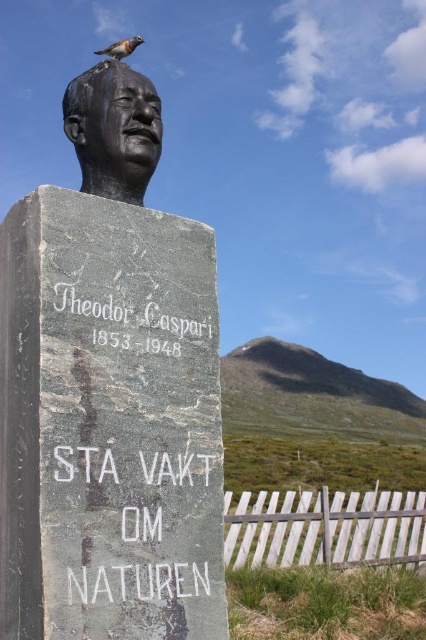
Question: Is bronze bust at upper center positioned behind brown speckled feather at upper center?

Choices:
 (A) yes
 (B) no

Answer: (B)

Question: Observing the image, what is the correct spatial positioning of bronze statue at upper center in reference to brown speckled feather at upper center?

Choices:
 (A) right
 (B) left

Answer: (A)

Question: Can you confirm if bronze bust at upper center is smaller than brown speckled feather at upper center?

Choices:
 (A) yes
 (B) no

Answer: (A)

Question: Which point appears farthest from the camera in this image?

Choices:
 (A) (135, 44)
 (B) (117, 390)

Answer: (A)

Question: Estimate the real-world distances between objects in this image. Which object is closer to the brown speckled feather at upper center?

Choices:
 (A) bronze statue at upper center
 (B) bronze bust at upper center

Answer: (B)

Question: Which of the following is the closest to the observer?

Choices:
 (A) bronze bust at upper center
 (B) brown speckled feather at upper center
 (C) bronze statue at upper center

Answer: (A)